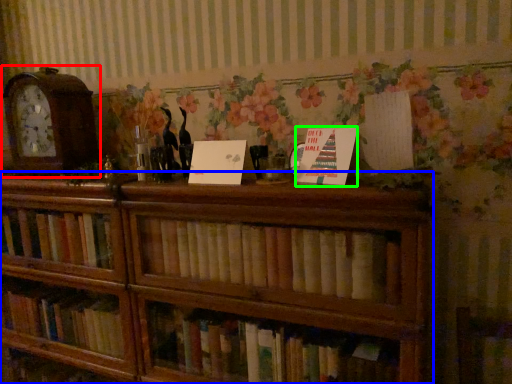
Question: Which is nearer to the alarm clock (highlighted by a red box)? bookcase (highlighted by a blue box) or paperback book (highlighted by a green box).

Choices:
 (A) bookcase
 (B) paperback book

Answer: (A)